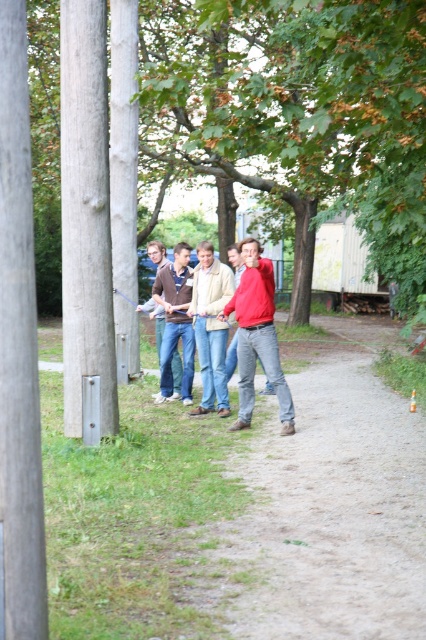
Between green leafy tree at center and matte red jacket at center, which one appears on the right side from the viewer's perspective?

Positioned to the right is matte red jacket at center.

Find the location of a particular element. The image size is (426, 640). green leafy tree at center is located at coordinates (299, 113).

Find the location of a particular element. This screenshot has width=426, height=640. green leafy tree at center is located at coordinates (299, 113).

Who is more distant from viewer, (408,205) or (126,176)?

Positioned behind is point (126,176).

Does point (416, 150) lie in front of point (117, 221)?

That is True.

In order to click on green leafy tree at center in this screenshot , I will do `click(299, 113)`.

Does smooth concrete pole at left come in front of matte red jacket at center?

No, it is behind matte red jacket at center.

Does smooth concrete pole at left have a lesser width compared to matte red jacket at center?

Indeed, smooth concrete pole at left has a lesser width compared to matte red jacket at center.

Is point (135, 285) closer to viewer compared to point (245, 392)?

No, it is behind (245, 392).

Find the location of a particular element. smooth concrete pole at left is located at coordinates (123, 145).